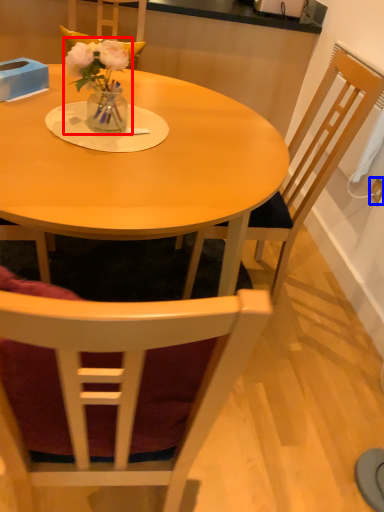
Question: Which object is further to the camera taking this photo, floral arrangement (highlighted by a red box) or power outlet (highlighted by a blue box)?

Choices:
 (A) floral arrangement
 (B) power outlet

Answer: (B)